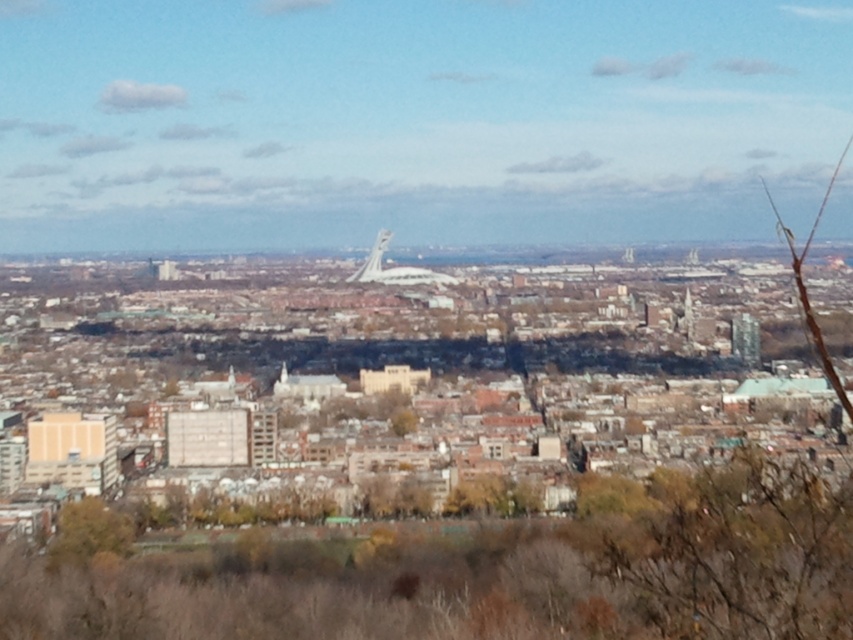
Question: Can you confirm if green leafy tree at lower left is positioned above shiny metallic tower at center?

Choices:
 (A) no
 (B) yes

Answer: (A)

Question: Does green leafy tree at lower left appear under shiny metallic tower at center?

Choices:
 (A) no
 (B) yes

Answer: (B)

Question: Is brown leafy tree at center positioned behind shiny metallic tower at center?

Choices:
 (A) no
 (B) yes

Answer: (B)

Question: Considering the real-world distances, which object is farthest from the green leafy tree at lower left?

Choices:
 (A) shiny metallic tower at center
 (B) brown leafy tree at center

Answer: (A)

Question: Estimate the real-world distances between objects in this image. Which object is farther from the brown leafy tree at center?

Choices:
 (A) shiny metallic tower at center
 (B) green leafy tree at lower left

Answer: (A)

Question: Which object appears closest to the camera in this image?

Choices:
 (A) brown leafy tree at center
 (B) green leafy tree at lower left

Answer: (A)